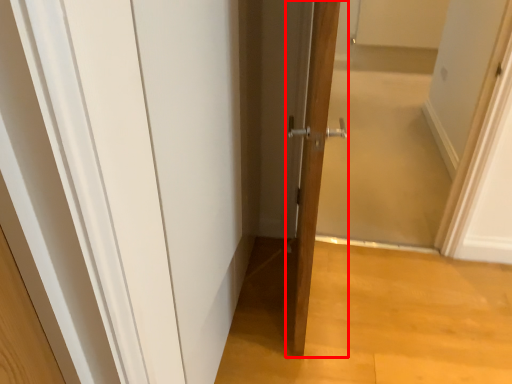
Question: From the image's perspective, where is door (annotated by the red box) located relative to screen door?

Choices:
 (A) below
 (B) above

Answer: (A)